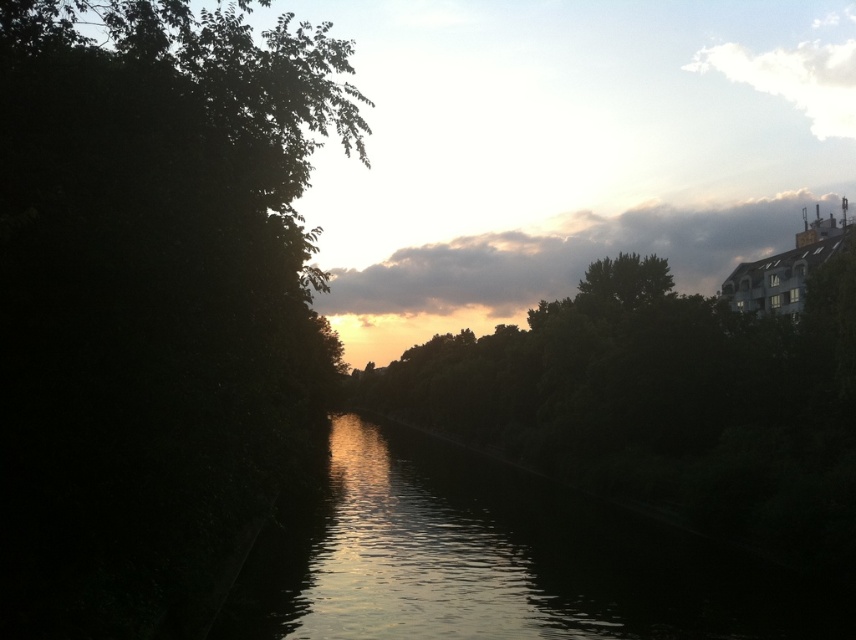
You are an artist who wants to paint this scene. You need to decide which area to focus on first based on their sizes. Which object is wider, the dark green leafy tree at left or the silvery reflective water at center?

The dark green leafy tree at left is wider than the silvery reflective water at center according to the description.

Looking at this image, you are standing on the bank of the waterway and want to take a photo of the dark green leafy tree at left and the silvery reflective water at center. Which object will appear closer to the camera in the photo?

The dark green leafy tree at left will appear closer to the camera in the photo because it is positioned in front of the silvery reflective water at center.